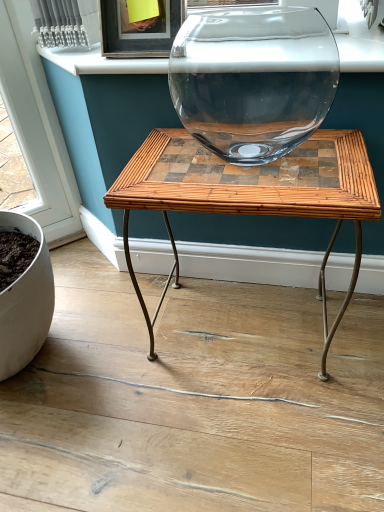
I want to click on free spot in front of bamboo/rattan table at center, so click(256, 435).